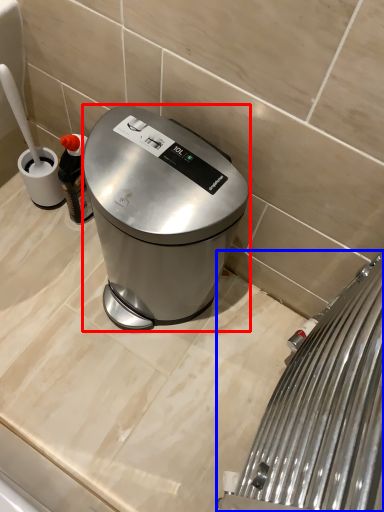
Question: Among these objects, which one is farthest to the camera, kitchen appliance (highlighted by a red box) or home appliance (highlighted by a blue box)?

Choices:
 (A) kitchen appliance
 (B) home appliance

Answer: (A)